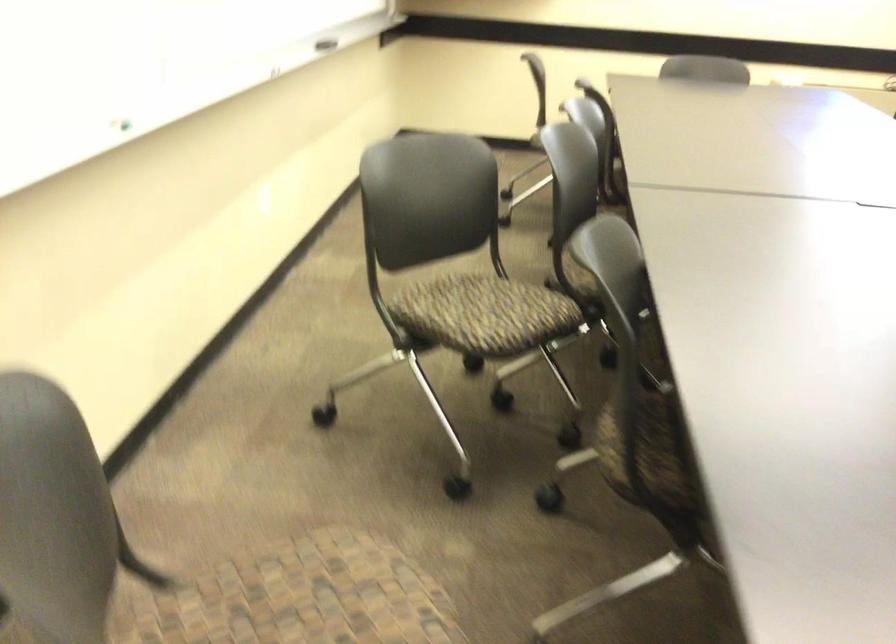
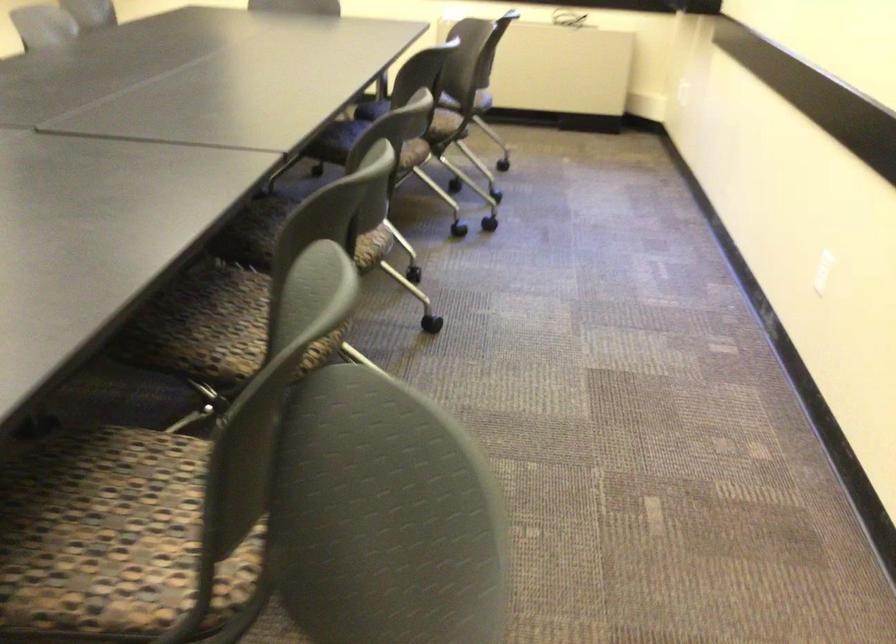
Question: The images are taken continuously from a first-person perspective. In which direction are you moving?

Choices:
 (A) Left
 (B) Right
 (C) Forward
 (D) Backward

Answer: (B)